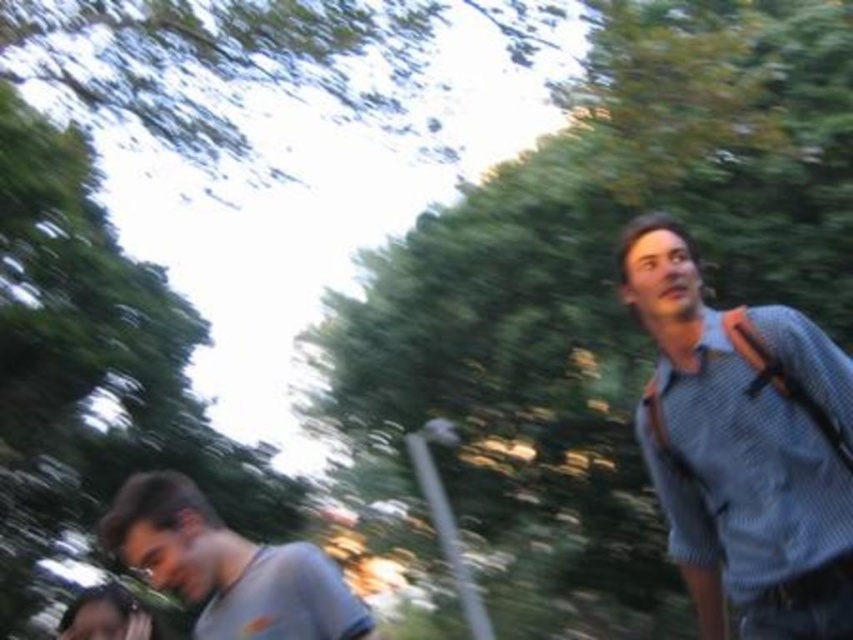
You are a photographer trying to capture the two individuals in the scene. You notice that the textured blue shirt at right is at point [744,445]. Where should you position your camera to ensure both individuals are in frame?

The textured blue shirt at right is located at point [744,445]. To include both individuals in the frame, position the camera so that it captures the area around this coordinate while also ensuring the other person is visible within the same field of view.

You are a photographer trying to capture a clear shot of both the textured blue shirt at right and the gray cotton shirt at lower left. Since the subjects are moving, you need to focus on the one closer to the camera first. Which shirt should you focus on first?

The textured blue shirt at right is positioned over gray cotton shirt at lower left, meaning it is closer to the camera. You should focus on the textured blue shirt at right first.